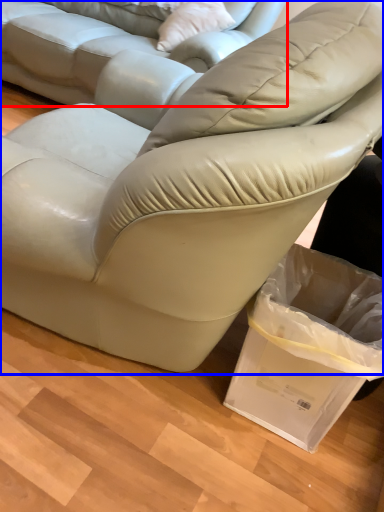
Question: Which of the following is the closest to the observer, studio couch (highlighted by a red box) or studio couch (highlighted by a blue box)?

Choices:
 (A) studio couch
 (B) studio couch

Answer: (B)